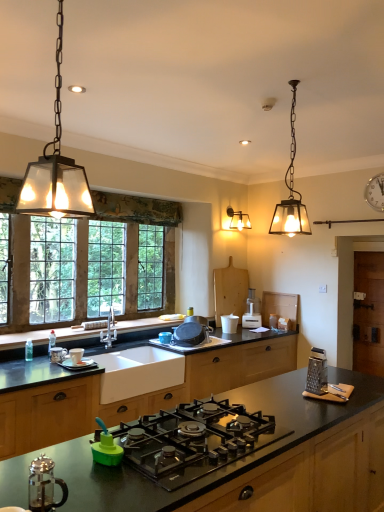
What are the coordinates of `free point above shiny black countertop at center (from a real-world perspective)` in the screenshot? It's located at (205, 424).